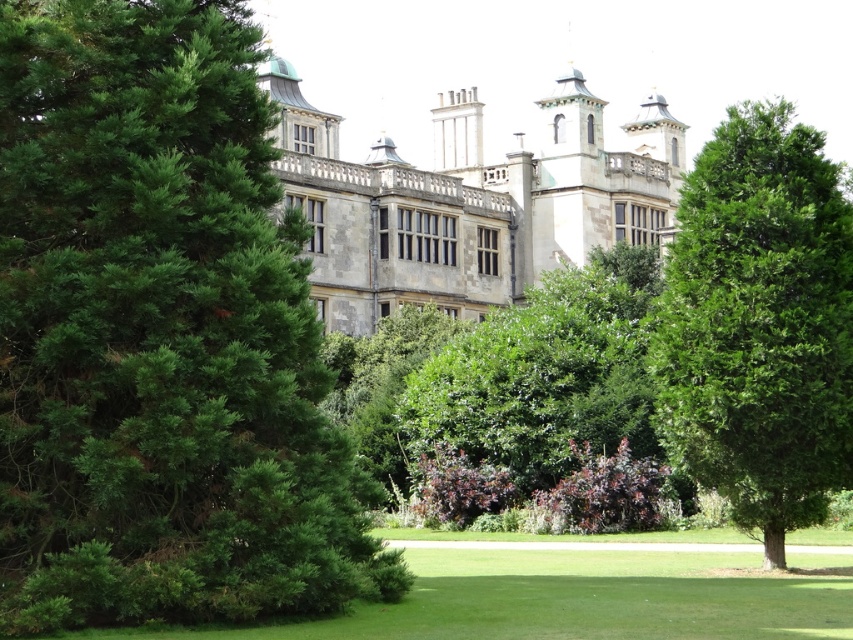
You are standing at the center of the lawn in front of the historic building. There are two points marked in the image. Which point, point (80, 12) or point (811, 333), is closer to you?

Point (80, 12) is closer to the camera than point (811, 333), so it is closer to you.

You are standing on the lawn looking towards the historic building. You see a green leafy tree at center and a green leafy bush at center. Which one is closer to you?

The green leafy tree at center is closer to you because it is in front of the green leafy bush at center.